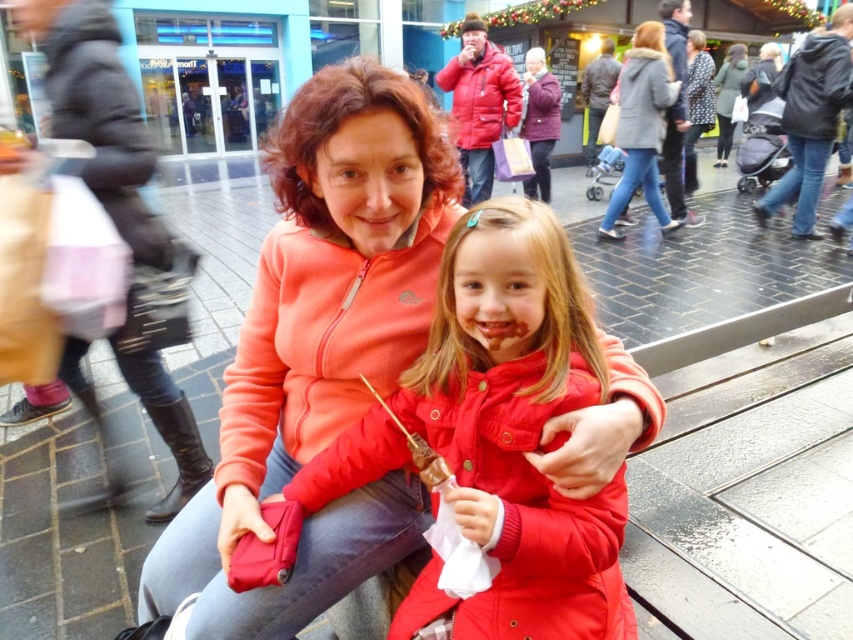
Question: Based on their relative distances, which object is farther from the polka dot fabric coat at upper right?

Choices:
 (A) purple fuzzy jacket at upper center
 (B) dark gray wool coat at upper right
 (C) gray wool coat at upper center
 (D) dark gray matte jacket at upper right

Answer: (B)

Question: Which point is closer to the camera?

Choices:
 (A) (x=624, y=68)
 (B) (x=694, y=100)

Answer: (A)

Question: Which is farther from the dark gray woolen jacket at upper right?

Choices:
 (A) dark gray wool coat at upper right
 (B) matte black jacket at upper center

Answer: (B)

Question: Is dark gray matte jacket at upper right to the left of matte red jacket at upper center from the viewer's perspective?

Choices:
 (A) no
 (B) yes

Answer: (A)

Question: Where is matte red jacket at center located in relation to dark gray wool coat at upper right in the image?

Choices:
 (A) right
 (B) left

Answer: (B)

Question: Where is matte red jacket at center located in relation to polka dot fabric coat at upper right in the image?

Choices:
 (A) left
 (B) right

Answer: (A)